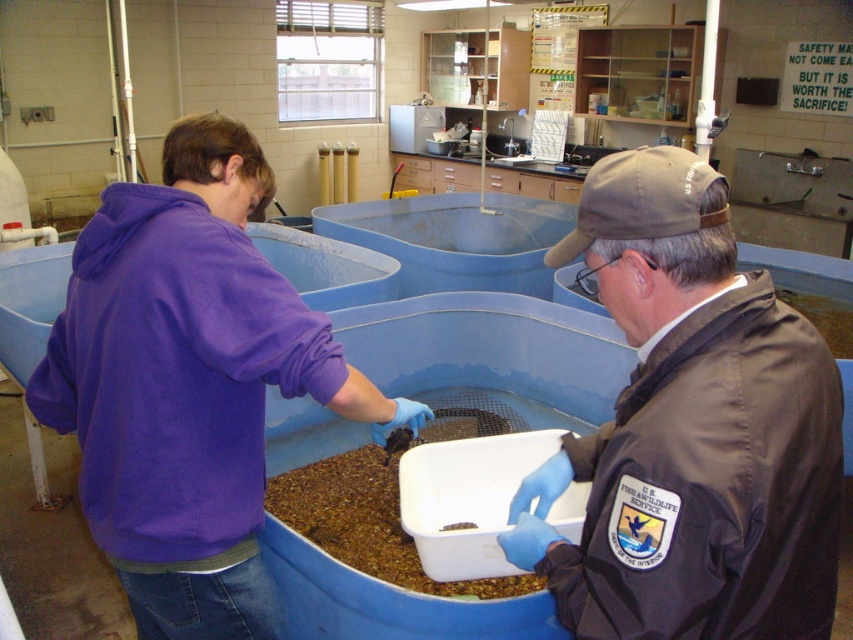
Between brown leather jacket at center and purple fleece jacket at center, which one is positioned lower?

purple fleece jacket at center is lower down.

Is brown leather jacket at center below purple fleece jacket at center?

No, brown leather jacket at center is not below purple fleece jacket at center.

Is point (581, 572) closer to camera compared to point (219, 593)?

Yes.

You are a GUI agent. You are given a task and a screenshot of the screen. Output one action in this format:
    pyautogui.click(x=<x>, y=<y>)
    Task: Click on the brown leather jacket at center
    The height and width of the screenshot is (640, 853).
    Given the screenshot: What is the action you would take?
    pyautogui.click(x=689, y=429)